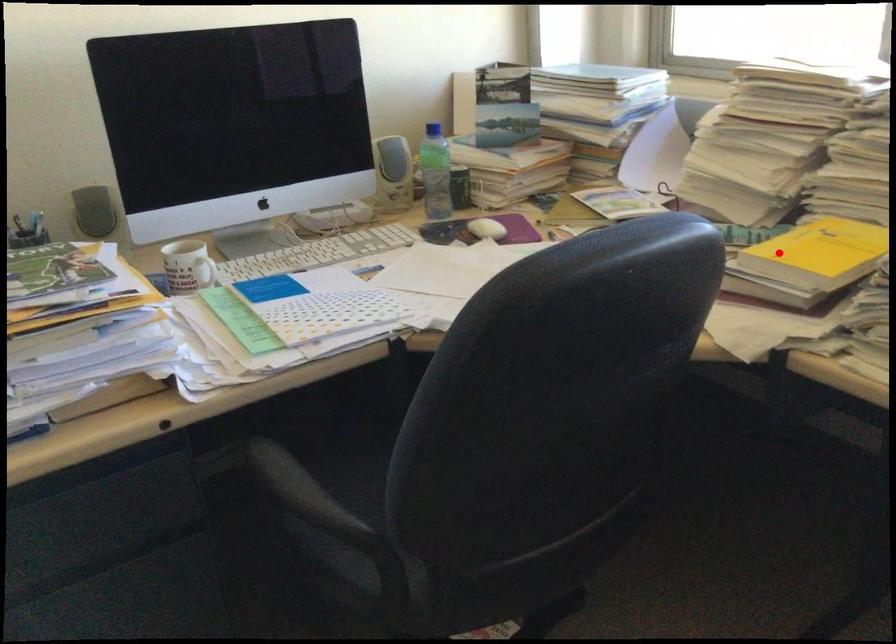
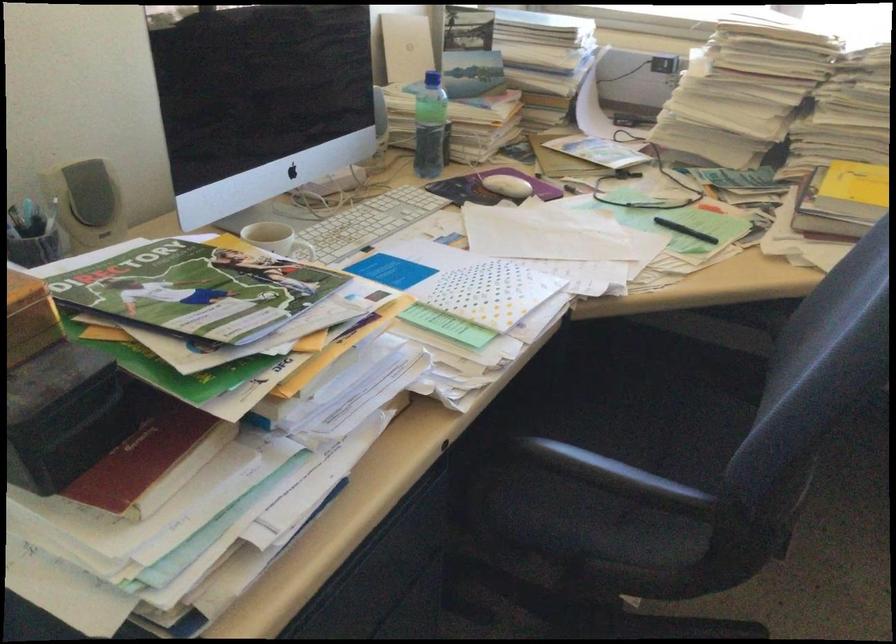
Question: I am providing you with two images of the same scene from different viewpoints. A red point is shown in image1. For the corresponding object point in image2, is it positioned nearer or farther from the camera?

Choices:
 (A) Nearer
 (B) Farther

Answer: (B)